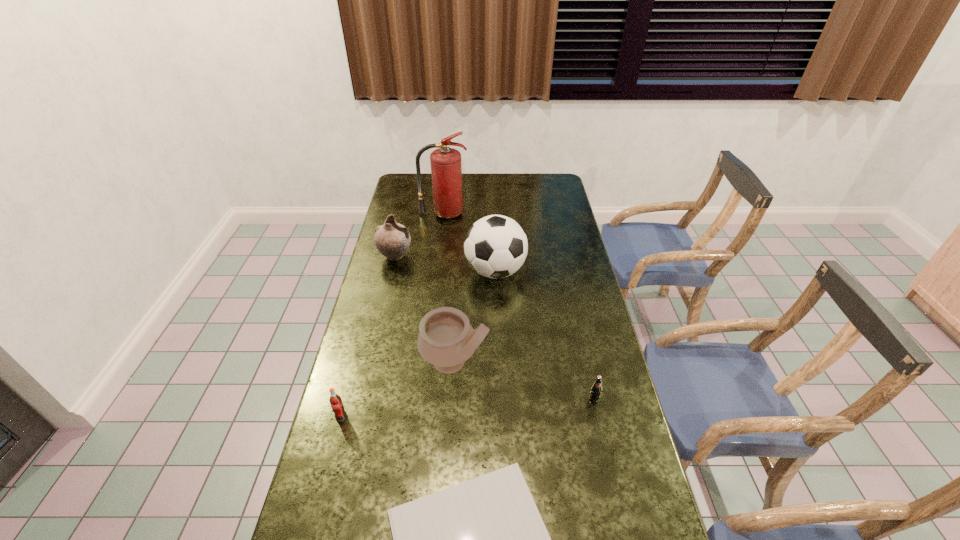
In the image, there is a desktop. At what (x,y) coordinates should I click in order to perform the action: click on free space at the far edge. Please return your answer as a coordinate pair (x, y). This screenshot has width=960, height=540. Looking at the image, I should click on (483, 191).

Find the location of a particular element. This screenshot has height=540, width=960. vacant region at the left edge of the desktop is located at coordinates (348, 484).

Image resolution: width=960 pixels, height=540 pixels. I want to click on free space at the right edge of the desktop, so click(x=581, y=399).

Where is `vacant space at the far right corner`? The width and height of the screenshot is (960, 540). vacant space at the far right corner is located at coordinates (549, 179).

Locate an element on the screen. The width and height of the screenshot is (960, 540). free space between the left pottery and the farthest object is located at coordinates (420, 235).

This screenshot has width=960, height=540. What are the coordinates of `empty location between the right pottery and the fire extinguisher` in the screenshot? It's located at [449, 288].

Find the location of a particular element. The height and width of the screenshot is (540, 960). vacant point located between the second nearest object and the farthest object is located at coordinates (393, 315).

The height and width of the screenshot is (540, 960). Find the location of `vacant area that lies between the shorter pop and the left pottery`. vacant area that lies between the shorter pop and the left pottery is located at coordinates (494, 328).

You are a GUI agent. You are given a task and a screenshot of the screen. Output one action in this format:
    pyautogui.click(x=<x>, y=<y>)
    Task: Click on the vacant area that lies between the fire extinguisher and the right pop
    
    Given the screenshot: What is the action you would take?
    pyautogui.click(x=518, y=307)

The height and width of the screenshot is (540, 960). I want to click on free space between the tallest object and the shorter pop, so click(x=518, y=307).